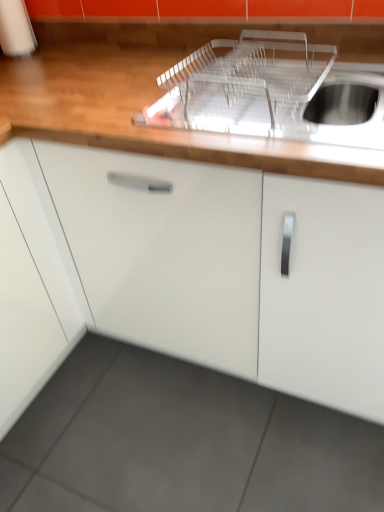
Image resolution: width=384 pixels, height=512 pixels. Find the location of `white glossy cabinet at center`. white glossy cabinet at center is located at coordinates (203, 269).

The width and height of the screenshot is (384, 512). What do you see at coordinates (161, 93) in the screenshot?
I see `transparent plastic dish rack at upper center` at bounding box center [161, 93].

Locate an element on the screen. This screenshot has height=512, width=384. white glossy cabinet at center is located at coordinates (203, 269).

Can you confirm if transparent plastic sink at upper right is shorter than transparent plastic dish rack at upper center?

Yes.

Which object is further away from the camera taking this photo, transparent plastic sink at upper right or transparent plastic dish rack at upper center?

transparent plastic sink at upper right is further away from the camera.

Between transparent plastic sink at upper right and transparent plastic dish rack at upper center, which one has smaller width?

transparent plastic sink at upper right is thinner.

Is transparent plastic sink at upper right with transparent plastic dish rack at upper center?

transparent plastic sink at upper right and transparent plastic dish rack at upper center are not in contact.

Does transparent plastic dish rack at upper center have a greater height compared to white glossy cabinet at center?

Incorrect, the height of transparent plastic dish rack at upper center is not larger of that of white glossy cabinet at center.

Would you say transparent plastic dish rack at upper center is a long distance from white glossy cabinet at center?

No, transparent plastic dish rack at upper center is not far from white glossy cabinet at center.

Is white glossy cabinet at center at the back of transparent plastic dish rack at upper center?

Yes.

In terms of width, does transparent plastic dish rack at upper center look wider or thinner when compared to white glossy cabinet at center?

Clearly, transparent plastic dish rack at upper center has less width compared to white glossy cabinet at center.

Considering the sizes of objects white glossy cabinet at center and transparent plastic dish rack at upper center in the image provided, who is shorter, white glossy cabinet at center or transparent plastic dish rack at upper center?

transparent plastic dish rack at upper center.

In the image, there is a transparent plastic dish rack at upper center. Where is `cabinetry below it (from a real-world perspective)`? This screenshot has height=512, width=384. cabinetry below it (from a real-world perspective) is located at coordinates (203, 269).

Considering the positions of objects white glossy cabinet at center and transparent plastic dish rack at upper center in the image provided, who is more to the left, white glossy cabinet at center or transparent plastic dish rack at upper center?

From the viewer's perspective, white glossy cabinet at center appears more on the left side.

Considering the relative positions of transparent plastic sink at upper right and white glossy cabinet at center in the image provided, is transparent plastic sink at upper right in front of white glossy cabinet at center?

No, transparent plastic sink at upper right is further to the viewer.

Is white glossy cabinet at center surrounded by transparent plastic sink at upper right?

That's incorrect, white glossy cabinet at center is not inside transparent plastic sink at upper right.

Which of these two, transparent plastic sink at upper right or white glossy cabinet at center, stands taller?

white glossy cabinet at center.

Does point (252, 126) appear closer or farther from the camera than point (233, 250)?

Clearly, point (252, 126) is closer to the camera than point (233, 250).

Does transparent plastic dish rack at upper center contain transparent plastic sink at upper right?

Absolutely, transparent plastic sink at upper right is inside transparent plastic dish rack at upper center.

From the image's perspective, is transparent plastic dish rack at upper center located above transparent plastic sink at upper right?

No.

At what (x,y) coordinates should I click in order to perform the action: click on sink behind the transparent plastic dish rack at upper center. Please return your answer as a coordinate pair (x, y). The width and height of the screenshot is (384, 512). Looking at the image, I should click on (261, 91).

Is transparent plastic dish rack at upper center touching transparent plastic sink at upper right?

No, transparent plastic dish rack at upper center is not beside transparent plastic sink at upper right.

From a real-world perspective, which object rests below the other?

In real-world perspective, white glossy cabinet at center is lower.

From the image's perspective, is white glossy cabinet at center located above or below transparent plastic sink at upper right?

white glossy cabinet at center is situated lower than transparent plastic sink at upper right in the image.

Is white glossy cabinet at center turned away from transparent plastic sink at upper right?

That's not correct — white glossy cabinet at center is not looking away from transparent plastic sink at upper right.

What's the angular difference between white glossy cabinet at center and transparent plastic sink at upper right's facing directions?

The angular difference between white glossy cabinet at center and transparent plastic sink at upper right is 0.000274 degrees.

Locate an element on the screen. This screenshot has height=512, width=384. countertop below the transparent plastic sink at upper right (from a real-world perspective) is located at coordinates (161, 93).

Locate an element on the screen. cabinetry below the transparent plastic dish rack at upper center (from the image's perspective) is located at coordinates (203, 269).

Estimate the real-world distances between objects in this image. Which object is further from transparent plastic sink at upper right, white glossy cabinet at center or transparent plastic dish rack at upper center?

white glossy cabinet at center is further to transparent plastic sink at upper right.

Looking at the image, which one is located closer to transparent plastic dish rack at upper center, transparent plastic sink at upper right or white glossy cabinet at center?

transparent plastic sink at upper right.

Looking at the image, which one is located further to white glossy cabinet at center, transparent plastic sink at upper right or transparent plastic dish rack at upper center?

transparent plastic sink at upper right is positioned further to the anchor white glossy cabinet at center.

Based on their spatial positions, is transparent plastic dish rack at upper center or transparent plastic sink at upper right further from white glossy cabinet at center?

The object further to white glossy cabinet at center is transparent plastic sink at upper right.

Estimate the real-world distances between objects in this image. Which object is closer to transparent plastic sink at upper right, transparent plastic dish rack at upper center or white glossy cabinet at center?

Based on the image, transparent plastic dish rack at upper center appears to be nearer to transparent plastic sink at upper right.

Based on their spatial positions, is white glossy cabinet at center or transparent plastic sink at upper right closer to transparent plastic dish rack at upper center?

transparent plastic sink at upper right lies closer to transparent plastic dish rack at upper center than the other object.

Find the location of a particular element. Image resolution: width=384 pixels, height=512 pixels. sink situated between white glossy cabinet at center and transparent plastic dish rack at upper center from left to right is located at coordinates (261, 91).